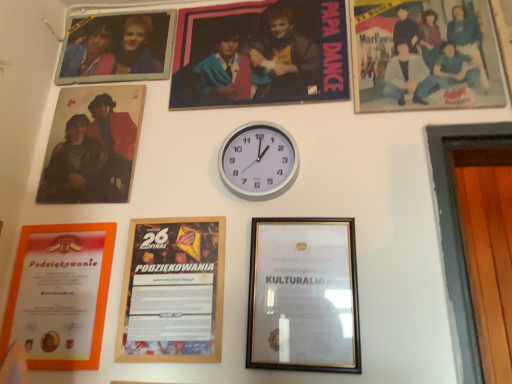
Question: Is gold metallic picture frame at center, the second picture frame when ordered from right to left, directly adjacent to matte plastic poster at upper center, the third picture frame from the right?

Choices:
 (A) yes
 (B) no

Answer: (B)

Question: Does gold metallic picture frame at center, the second picture frame when ordered from right to left, appear on the right side of matte plastic poster at upper center, positioned as the fifth picture frame in left-to-right order?

Choices:
 (A) yes
 (B) no

Answer: (A)

Question: Is gold metallic picture frame at center, the second picture frame when ordered from right to left, oriented away from matte plastic poster at upper center, positioned as the fifth picture frame in left-to-right order?

Choices:
 (A) no
 (B) yes

Answer: (A)

Question: From a real-world perspective, is gold metallic picture frame at center, the sixth picture frame positioned from the left, on matte plastic poster at upper center, the third picture frame from the right?

Choices:
 (A) no
 (B) yes

Answer: (A)

Question: Does gold metallic picture frame at center, the second picture frame when ordered from right to left, have a lesser height compared to matte plastic poster at upper center, positioned as the fifth picture frame in left-to-right order?

Choices:
 (A) yes
 (B) no

Answer: (A)

Question: Is gold metallic picture frame at center, the sixth picture frame positioned from the left, taller than matte plastic poster at upper center, positioned as the fifth picture frame in left-to-right order?

Choices:
 (A) no
 (B) yes

Answer: (A)

Question: Does matte plastic poster at upper center, the third picture frame from the right, come behind gold metallic picture frame at center, the second picture frame when ordered from right to left?

Choices:
 (A) yes
 (B) no

Answer: (A)

Question: Does matte plastic poster at upper center, positioned as the fifth picture frame in left-to-right order, have a smaller size compared to gold metallic picture frame at center, the second picture frame when ordered from right to left?

Choices:
 (A) no
 (B) yes

Answer: (A)

Question: Can you confirm if matte plastic poster at upper center, the third picture frame from the right, is taller than gold metallic picture frame at center, the sixth picture frame positioned from the left?

Choices:
 (A) yes
 (B) no

Answer: (A)

Question: From the image's perspective, is matte plastic poster at upper center, positioned as the fifth picture frame in left-to-right order, located beneath gold metallic picture frame at center, the sixth picture frame positioned from the left?

Choices:
 (A) yes
 (B) no

Answer: (B)

Question: Is matte plastic poster at upper center, the third picture frame from the right, at the right side of gold metallic picture frame at center, the sixth picture frame positioned from the left?

Choices:
 (A) yes
 (B) no

Answer: (B)

Question: Could you tell me if matte plastic poster at upper center, the third picture frame from the right, is facing gold metallic picture frame at center, the second picture frame when ordered from right to left?

Choices:
 (A) yes
 (B) no

Answer: (B)

Question: Considering the relative sizes of orange paper certificate at lower left, arranged as the 7th picture frame when viewed from the right, and metallic photo frame at upper left, placed as the third picture frame when sorted from left to right, in the image provided, is orange paper certificate at lower left, arranged as the 7th picture frame when viewed from the right, bigger than metallic photo frame at upper left, placed as the third picture frame when sorted from left to right,?

Choices:
 (A) no
 (B) yes

Answer: (A)